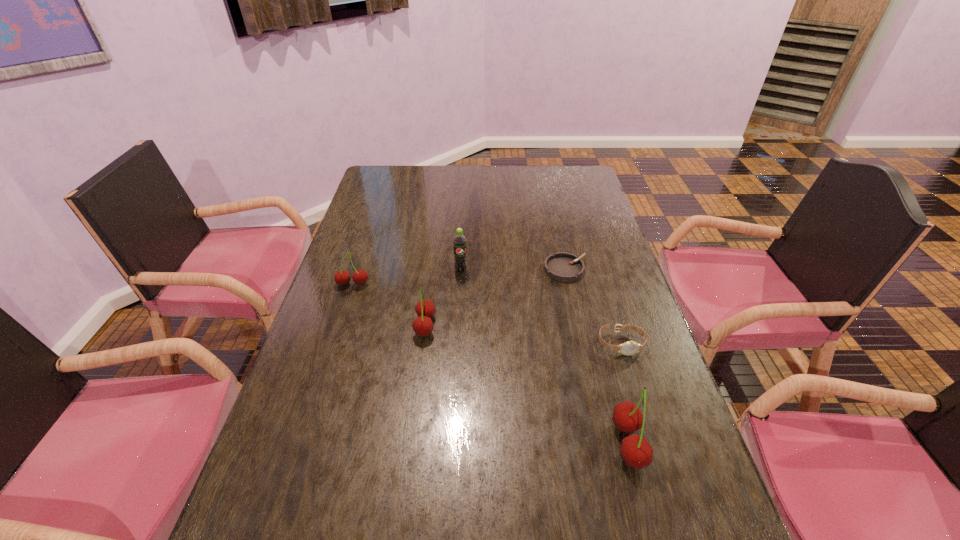
Locate an element on the screen. free space located on the surface of the second tallest cherry is located at coordinates (367, 326).

Locate an element on the screen. This screenshot has width=960, height=540. vacant space positioned 0.130m on the surface of the second tallest cherry is located at coordinates (367, 326).

Identify the location of vacant space positioned on the surface of the second tallest cherry. (374, 326).

Locate an element on the screen. This screenshot has height=540, width=960. free space located on the surface of the nearest object is located at coordinates click(x=677, y=443).

Where is `vacant space situated 0.070m on the face of the second shortest object`? This screenshot has height=540, width=960. vacant space situated 0.070m on the face of the second shortest object is located at coordinates (632, 379).

Where is `vacant region located 0.120m on the back of the shortest object`? vacant region located 0.120m on the back of the shortest object is located at coordinates (558, 235).

In order to click on vacant region located on the front label of the fourth object from right to left in this screenshot , I will do `click(458, 322)`.

Where is `object that is positioned at the left edge`? The height and width of the screenshot is (540, 960). object that is positioned at the left edge is located at coordinates (359, 277).

The image size is (960, 540). I want to click on cherry positioned at the right edge, so click(636, 452).

Locate an element on the screen. The image size is (960, 540). watch located at the right edge is located at coordinates (x=628, y=348).